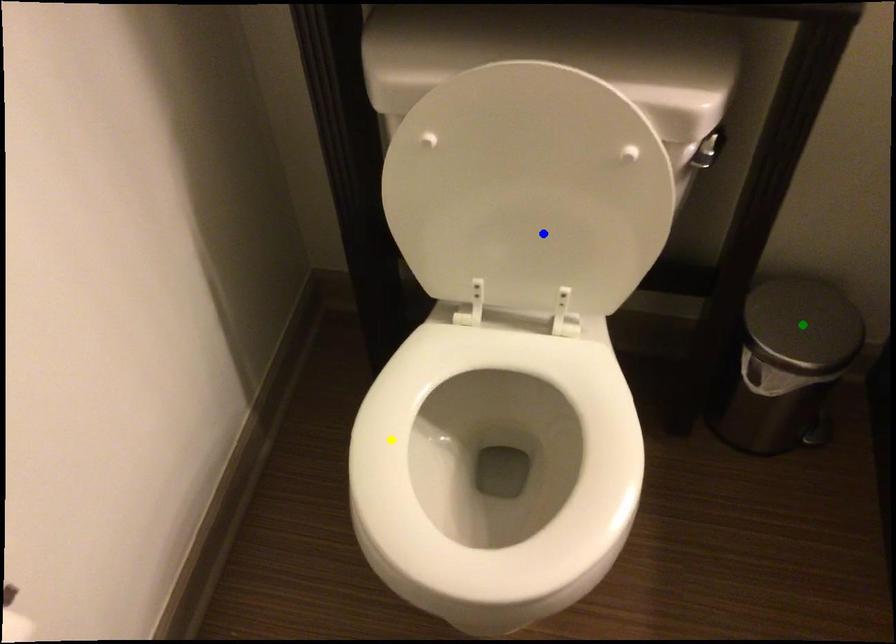
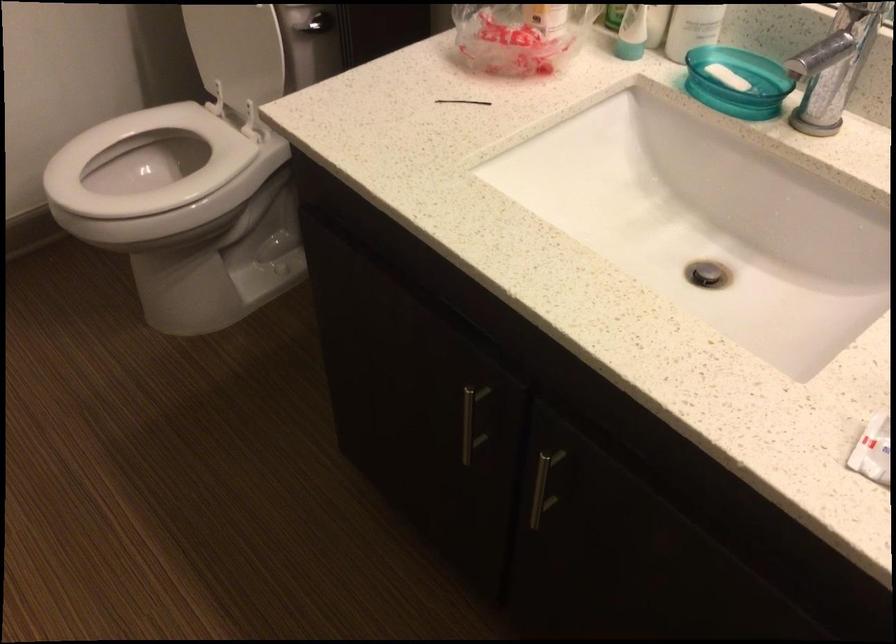
I am providing you with two images of the same scene from different viewpoints. Three points are marked in image1. Which point corresponds to a part or object that is occluded in image2?In image1, three points are marked. Which of them correspond to a part or object that is occluded in image2?Among the three points shown in image1, which one corresponds to a part or object that is no longer visible due to occlusion in image2?

green point cannot be seen in image2.